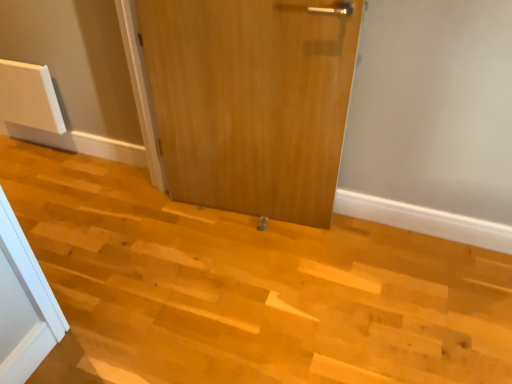
Image resolution: width=512 pixels, height=384 pixels. Identify the location of vacant space underneath wooden door at center (from a real-world perspective). (243, 206).